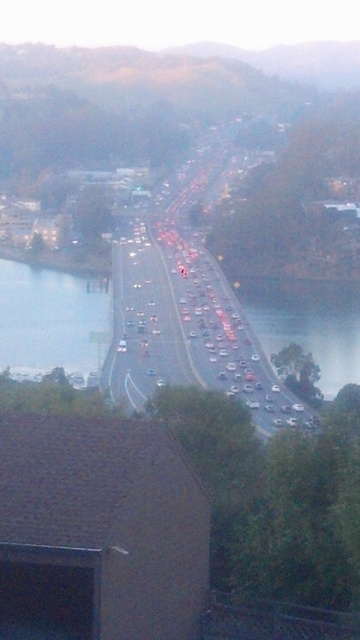
Question: Which of the following is the closest to the observer?

Choices:
 (A) clear water at lower left
 (B) clear water at lower right
 (C) metallic silver highway at center

Answer: (A)

Question: Where is metallic silver highway at center located in relation to clear water at lower left in the image?

Choices:
 (A) left
 (B) right

Answer: (B)

Question: Does metallic silver highway at center have a greater width compared to clear water at lower right?

Choices:
 (A) no
 (B) yes

Answer: (A)

Question: Which object appears closest to the camera in this image?

Choices:
 (A) clear water at lower left
 (B) clear water at lower right

Answer: (A)

Question: Is metallic silver highway at center thinner than clear water at lower left?

Choices:
 (A) yes
 (B) no

Answer: (A)

Question: Which point appears closest to the camera in this image?

Choices:
 (A) (313, 352)
 (B) (97, 307)

Answer: (A)